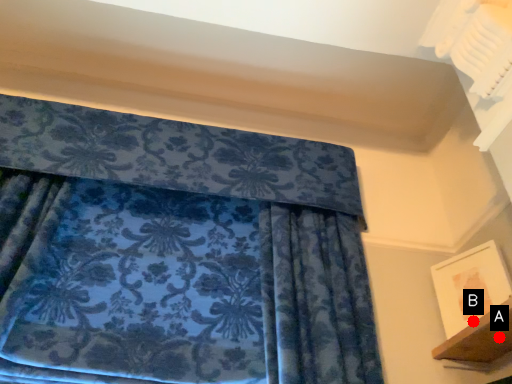
Question: Two points are circled on the image, labeled by A and B beside each circle. Which point is farther from the camera taking this photo?

Choices:
 (A) A is further
 (B) B is further

Answer: (B)